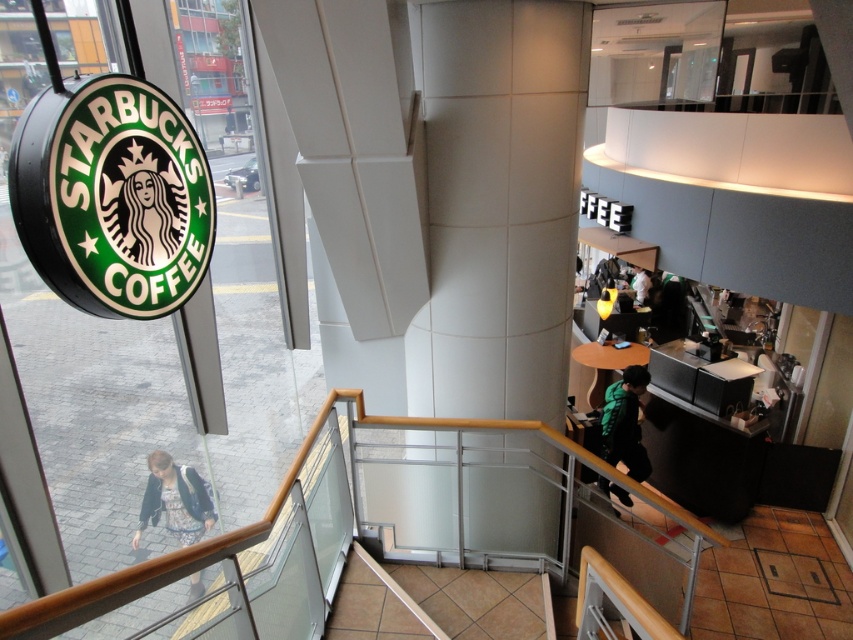
Does white tile pillar at center have a lesser height compared to green textured jacket at lower right?

In fact, white tile pillar at center may be taller than green textured jacket at lower right.

Does white tile pillar at center lie behind green textured jacket at lower right?

That is False.

Which is in front, point (462, 81) or point (618, 460)?

Point (462, 81)

Image resolution: width=853 pixels, height=640 pixels. What are the coordinates of `white tile pillar at center` in the screenshot? It's located at (498, 204).

Is white tile pillar at center to the right of denim jacket at lower left from the viewer's perspective?

Correct, you'll find white tile pillar at center to the right of denim jacket at lower left.

Who is shorter, white tile pillar at center or denim jacket at lower left?

Standing shorter between the two is denim jacket at lower left.

Identify the location of white tile pillar at center. [x=498, y=204].

The height and width of the screenshot is (640, 853). Find the location of `white tile pillar at center`. white tile pillar at center is located at coordinates (498, 204).

Is denim jacket at lower left smaller than green textured jacket at lower right?

No, denim jacket at lower left is not smaller than green textured jacket at lower right.

Does point (207, 509) come closer to viewer compared to point (614, 416)?

No.

Where is `denim jacket at lower left`? This screenshot has width=853, height=640. denim jacket at lower left is located at coordinates [175, 500].